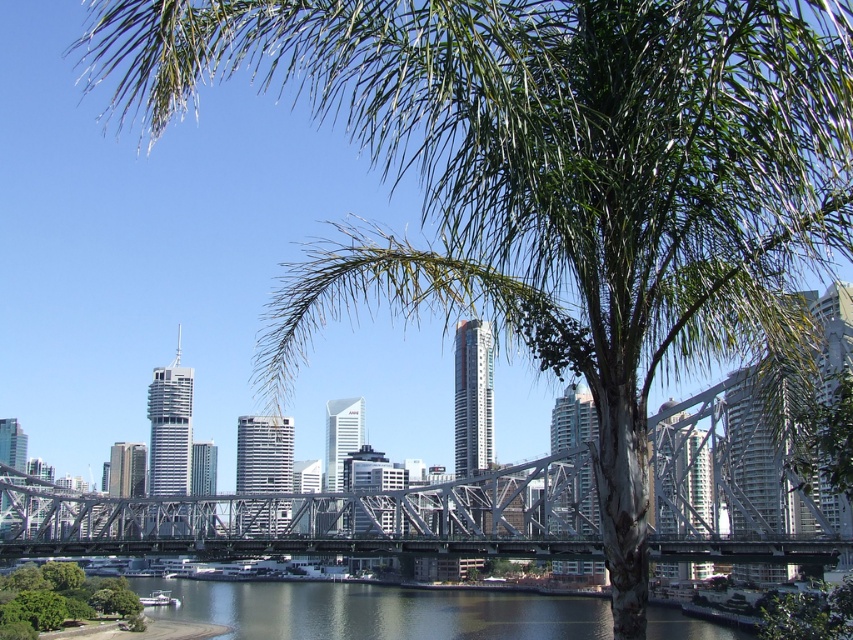
You are standing at the point with coordinates [376,611] in the image. What do you see directly in front of you?

At point [376,611] lies dark blue water at lower center.

You are a boat operator who needs to navigate a 100 feet long vessel through the water near the dark blue water at lower center and the green leafy tree at lower left. Can the vessel fit between them without touching either object?

The dark blue water at lower center and the green leafy tree at lower left are 109.16 feet apart. Since the vessel is 100 feet long, it can fit between them as the distance is greater than the vessel length.

You are standing at the base of the palm tree in the foreground. Looking towards the steel truss bridge in the middle ground, there is a point marked at coordinates (376,611). What does this point represent in the scene?

The point at (376,611) marks the location of dark blue water at lower center in the scene.